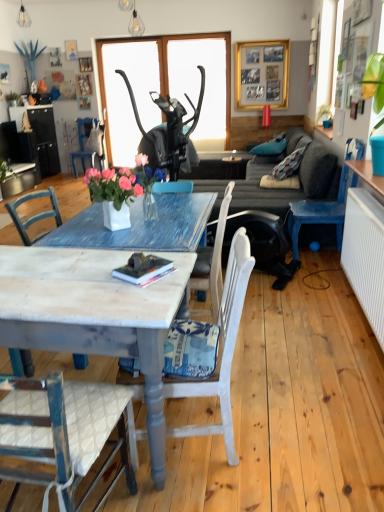
Question: Is black matte mask at center, placed as the 1th window screen when sorted from right to left, situated inside metallic wire bulb at upper center, which is the second lamp from right to left, or outside?

Choices:
 (A) outside
 (B) inside

Answer: (A)

Question: Is point (182, 89) positioned closer to the camera than point (23, 10)?

Choices:
 (A) farther
 (B) closer

Answer: (A)

Question: Which object is the farthest from the transparent plastic window screen at center, which is the first window screen from left to right?

Choices:
 (A) metallic pendant light at upper center, which ranks as the 2th lamp in back-to-front order
 (B) dark gray fabric couch at center
 (C) white painted wood chair at lower center, which is the third chair in back-to-front order
 (D) black matte mask at center, placed as the 1th window screen when sorted from right to left
 (E) blue painted wood chair at left, which appears as the 3th chair when ordered from the bottom

Answer: (C)

Question: Considering the real-world distances, which object is closest to the dark gray fabric couch at center?

Choices:
 (A) blue painted wood chair at left, which appears as the third chair when viewed from the right
 (B) distressed white marble coffee table at center
 (C) hardcover book at center
 (D) transparent plastic window screen at center, which is the first window screen from left to right
 (E) metallic pendant light at upper center, the first lamp when ordered from bottom to top

Answer: (D)